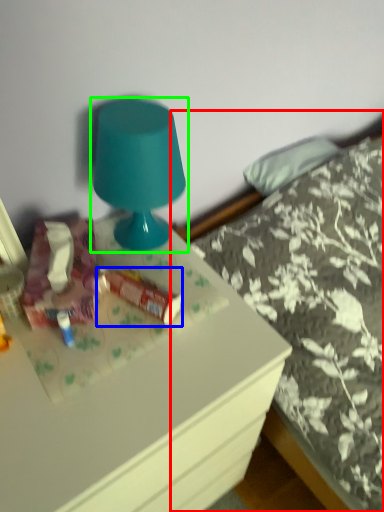
Question: Which object is positioned closest to bed (highlighted by a red box)? Select from stuff (highlighted by a blue box) and lamp (highlighted by a green box).

Choices:
 (A) stuff
 (B) lamp

Answer: (B)